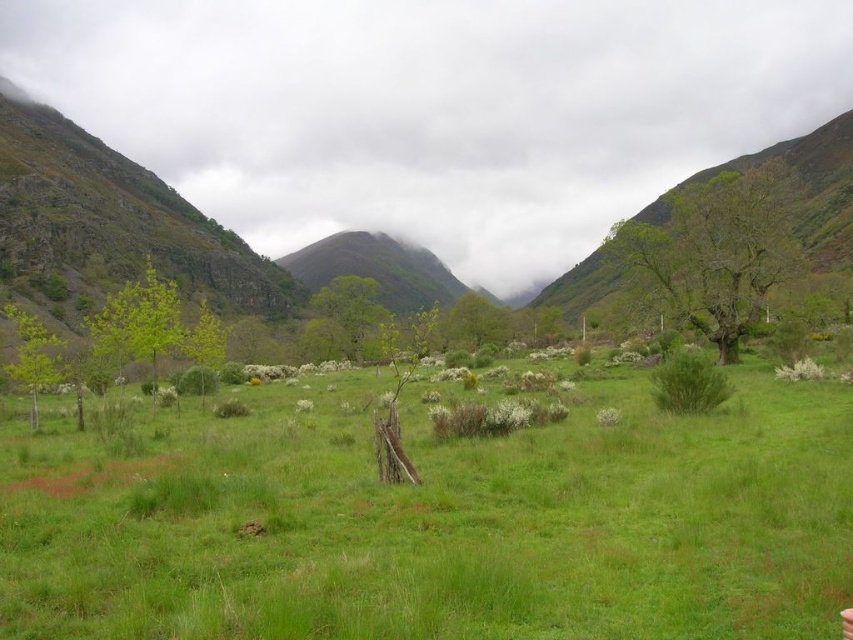
From the picture: You are standing in the valley scene and want to place a small flag at each of the two points marked as point (155, 616) and point (148, 220). Which point will have its flag appear larger in your view?

The flag placed at point (155, 616) will appear larger because it is closer to the camera compared to point (148, 220).

You are planning to set up a tent in the valley. The tent requires a flat area larger than the green grassy mountain at left. Can the green grassy at center accommodate your tent?

The green grassy at center has a smaller size compared to the green grassy mountain at left. Since the tent requires an area larger than the green grassy mountain at left, the green grassy at center cannot accommodate the tent as it is smaller in size.